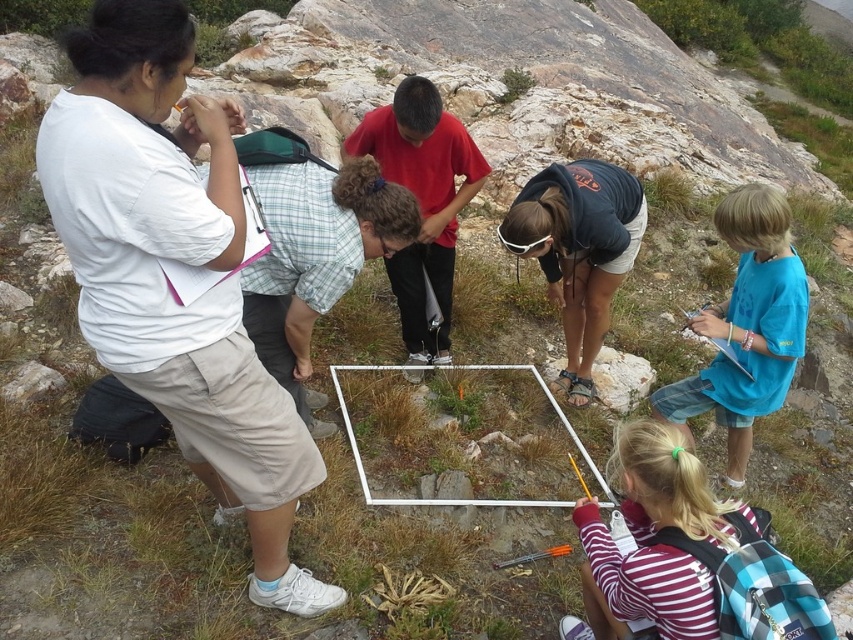
Looking at this image, does blue t-shirt at lower right appear on the right side of black fabric shirt at center?

Indeed, blue t-shirt at lower right is positioned on the right side of black fabric shirt at center.

Does blue t-shirt at lower right appear under black fabric shirt at center?

Yes.

What do you see at coordinates (746, 326) in the screenshot? I see `blue t-shirt at lower right` at bounding box center [746, 326].

This screenshot has height=640, width=853. Identify the location of blue t-shirt at lower right. (746, 326).

Who is more distant from viewer, (231, 224) or (608, 397)?

Point (608, 397)

Looking at this image, is white cotton shirt at upper left taller than gray rock at center?

Yes, white cotton shirt at upper left is taller than gray rock at center.

Who is more distant from viewer, (119, 200) or (630, 364)?

Positioned behind is point (630, 364).

Find the location of `white cotton shirt at upper left`. white cotton shirt at upper left is located at coordinates (164, 275).

Does white cotton shirt at upper left have a smaller size compared to black fabric shirt at center?

Actually, white cotton shirt at upper left might be larger than black fabric shirt at center.

Can you confirm if white cotton shirt at upper left is positioned to the left of black fabric shirt at center?

Indeed, white cotton shirt at upper left is positioned on the left side of black fabric shirt at center.

Who is more forward, (229, 296) or (596, 232)?

Positioned in front is point (229, 296).

What are the coordinates of `white cotton shirt at upper left` in the screenshot? It's located at (164, 275).